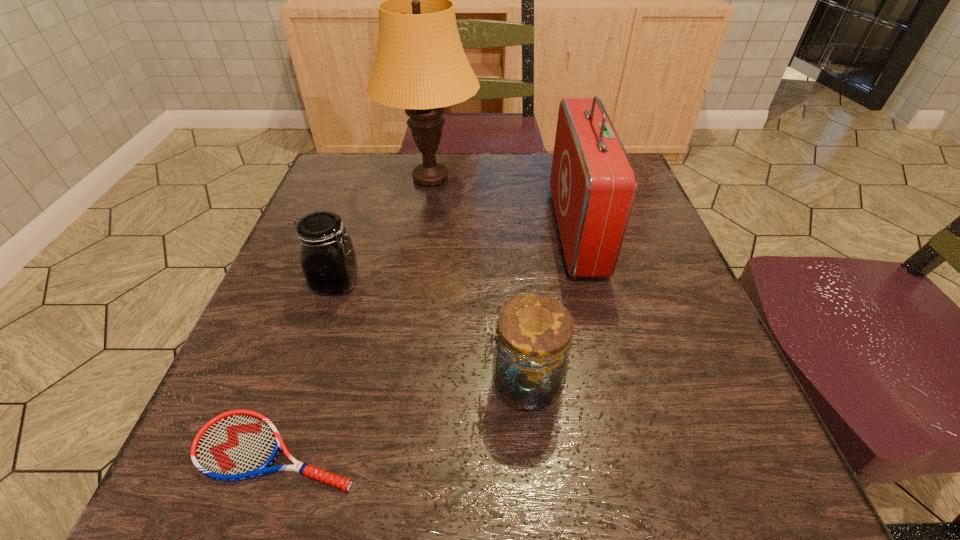
Identify the location of free region located 0.120m on the side of the rightmost object with the first aid cross symbol. (501, 231).

Identify the location of free spot located on the lid of the second object from right to left. (439, 383).

This screenshot has height=540, width=960. I want to click on vacant region located 0.080m on the lid of the second object from right to left, so click(x=432, y=383).

This screenshot has height=540, width=960. In order to click on free spot located on the lid of the second object from right to left in this screenshot , I will do `click(269, 383)`.

The height and width of the screenshot is (540, 960). Identify the location of vacant position located 0.090m on the lid of the farther jar. 411,283.

The width and height of the screenshot is (960, 540). I want to click on vacant space located 0.140m on the back of the shortest object, so (x=315, y=338).

Find the location of a particular element. The width and height of the screenshot is (960, 540). lampshade present at the far edge is located at coordinates (420, 65).

I want to click on the first-aid kit that is at the far edge, so click(593, 183).

Locate an element on the screen. The width and height of the screenshot is (960, 540). object present at the near edge is located at coordinates (236, 445).

Locate an element on the screen. The width and height of the screenshot is (960, 540). lampshade situated at the left edge is located at coordinates (420, 65).